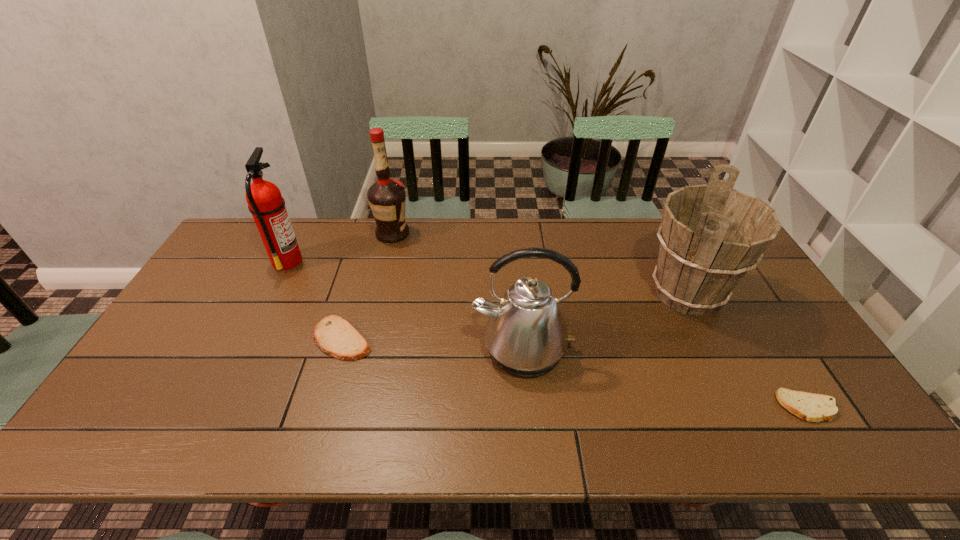
The image size is (960, 540). What are the coordinates of `vacant area between the liquor and the bucket` in the screenshot? It's located at (540, 264).

You are a GUI agent. You are given a task and a screenshot of the screen. Output one action in this format:
    pyautogui.click(x=<x>, y=<y>)
    Task: Click on the free space between the fire extinguisher and the taller pita bread
    This screenshot has width=960, height=540.
    Given the screenshot: What is the action you would take?
    pyautogui.click(x=315, y=300)

Where is `object that stands as the closest to the taller pita bread`? The image size is (960, 540). object that stands as the closest to the taller pita bread is located at coordinates (265, 202).

The height and width of the screenshot is (540, 960). What are the coordinates of `the fourth closest object relative to the nearest object` in the screenshot? It's located at (387, 198).

Locate an element on the screen. free space that satisfies the following two spatial constraints: 1. on the side of the shorter pita bread near the handle; 2. on the right side of the fire extinguisher is located at coordinates (214, 407).

This screenshot has width=960, height=540. Identify the location of blank space that satisfies the following two spatial constraints: 1. on the back side of the nearest object; 2. on the side of the leftmost object near the handle. (717, 261).

This screenshot has width=960, height=540. Identify the location of free spot that satisfies the following two spatial constraints: 1. on the side of the leftmost object near the handle; 2. on the left side of the nearest object. (214, 407).

The image size is (960, 540). I want to click on blank area in the image that satisfies the following two spatial constraints: 1. from the spout of the shortest object; 2. on the right side of the fourth object from left to right, so click(527, 407).